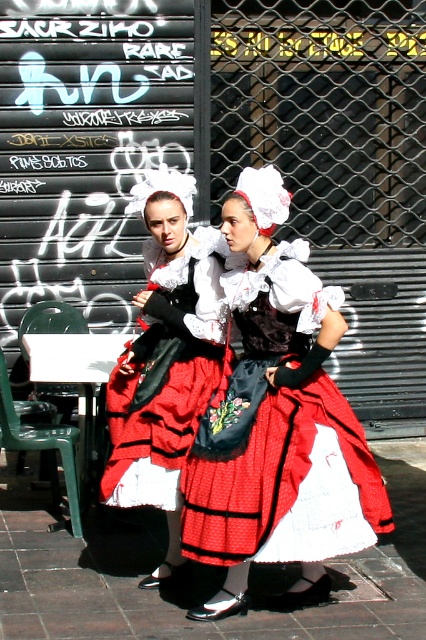
You are standing at the point marked as point (178, 600). What is the surface you are currently standing on?

The surface at point (178, 600) is smooth brick pavement at center.

Based on the photo, you are a photographer trying to capture a closeup of the graffiti on the black metal gate. You notice two points marked on the gate at coordinates point (402, 504) and point (166, 564). Which point is closer to your camera lens?

Point (402, 504) is further to the viewer than point (166, 564), so the point closer to your camera lens is point (166, 564).